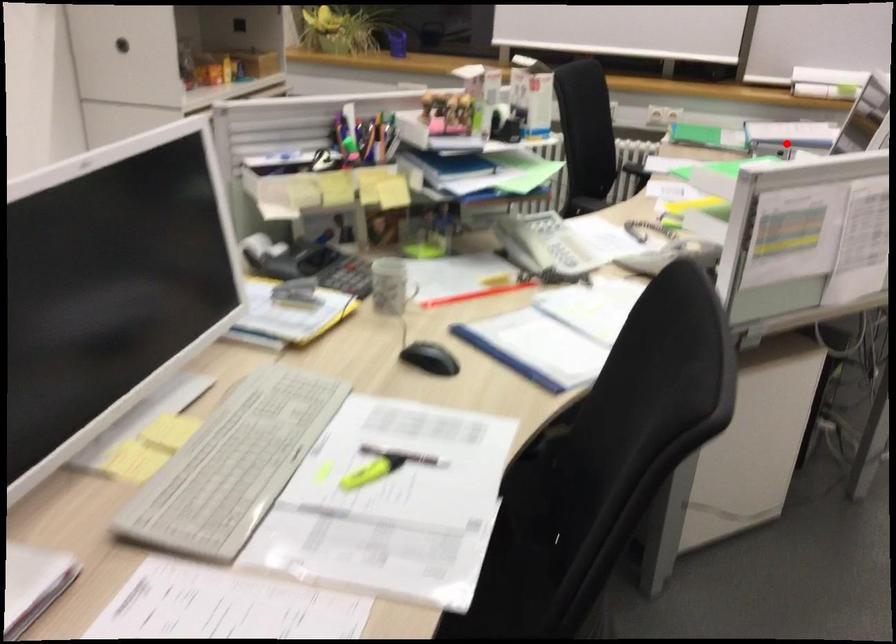
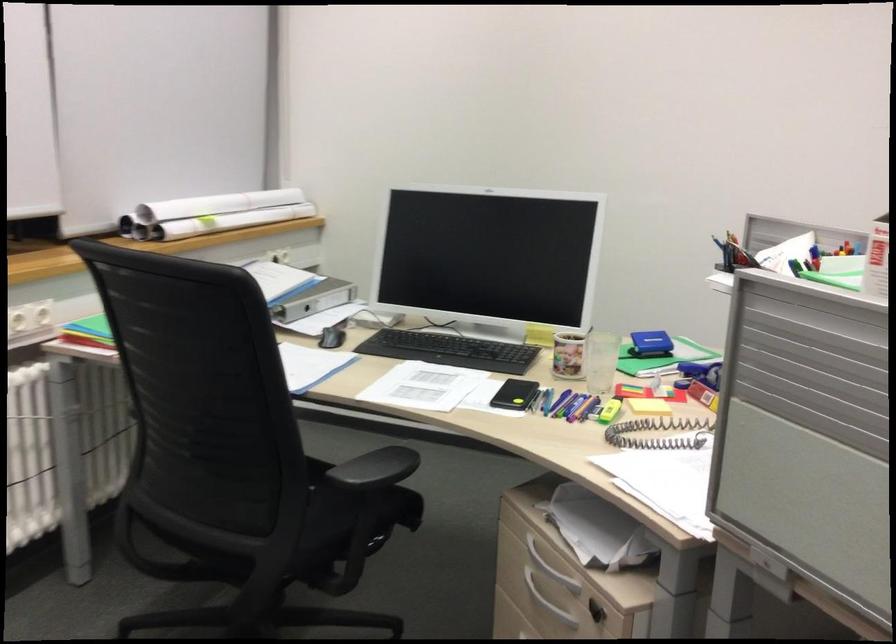
Question: A red point is marked in image1. In image2, is the corresponding 3D point closer to the camera or farther? Reply with the corresponding letter.

Choices:
 (A) The corresponding 3D point is closer.
 (B) The corresponding 3D point is farther.

Answer: (A)